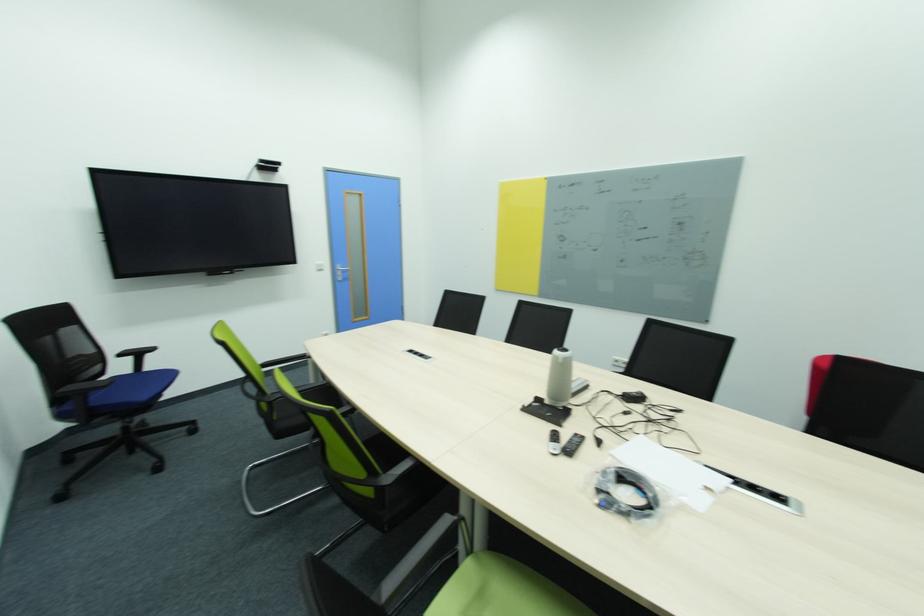
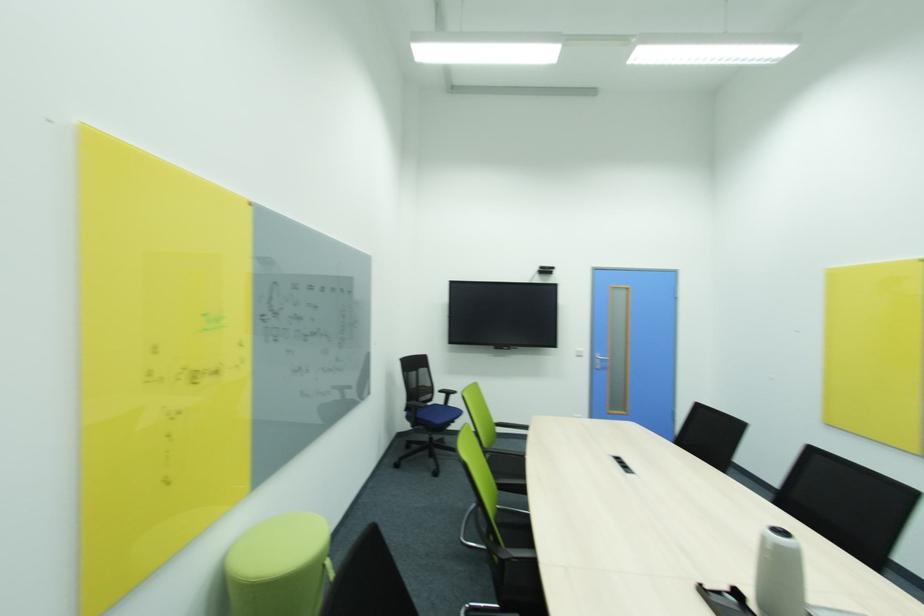
Question: Based on the continuous images, in which direction is the camera rotating? Reply with the corresponding letter.

Choices:
 (A) Left
 (B) Right
 (C) Up
 (D) Down

Answer: (A)